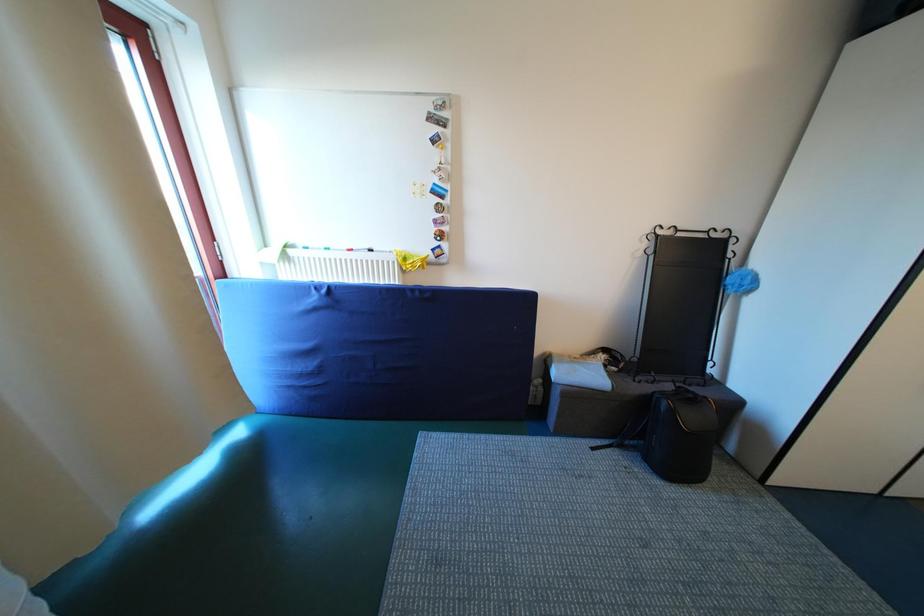
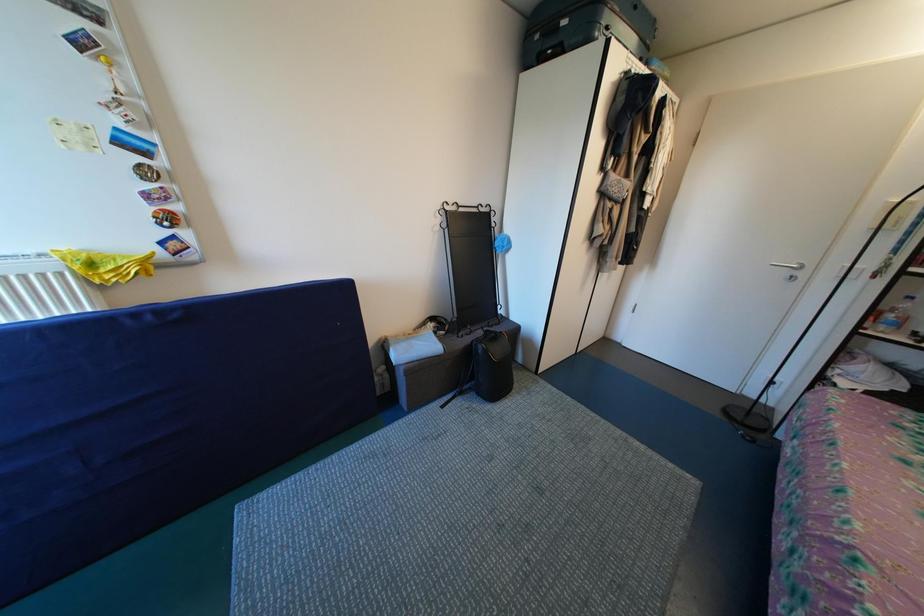
Question: How did the camera likely rotate?

Choices:
 (A) Left
 (B) Right
 (C) Up
 (D) Down

Answer: (B)